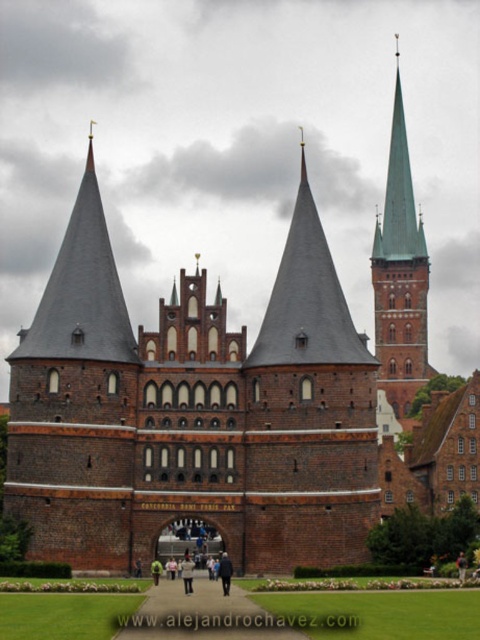
Which is above, black fabric person at center or light beige sweater at center?

black fabric person at center is higher up.

Does black fabric person at center have a larger size compared to light beige sweater at center?

Correct, black fabric person at center is larger in size than light beige sweater at center.

Does point (220, 557) come farther from viewer compared to point (191, 592)?

Yes.

Locate an element on the screen. The image size is (480, 640). black fabric person at center is located at coordinates (225, 572).

Is green grass at center to the right of dark blue jacket at center from the viewer's perspective?

In fact, green grass at center is to the left of dark blue jacket at center.

Is point (139, 636) farther from viewer compared to point (465, 563)?

No, (139, 636) is closer to viewer.

Where is `green grass at center`? green grass at center is located at coordinates (204, 616).

Consider the image. Does light beige sweater at center have a lesser height compared to green fabric jacket at lower center?

No, light beige sweater at center is not shorter than green fabric jacket at lower center.

Does light beige sweater at center come in front of green fabric jacket at lower center?

That is True.

This screenshot has height=640, width=480. In order to click on light beige sweater at center in this screenshot , I will do `click(187, 572)`.